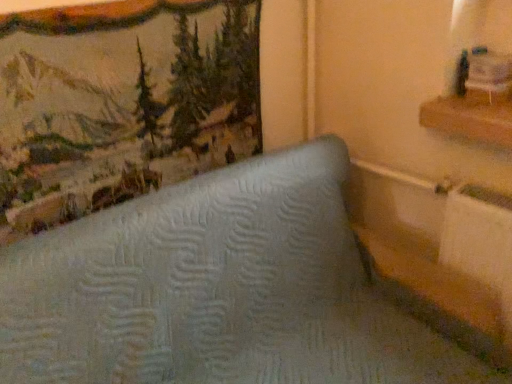
Question: Is light blue quilted mattress at center outside of wooden shelf at upper right?

Choices:
 (A) yes
 (B) no

Answer: (A)

Question: Is light blue quilted mattress at center thinner than wooden shelf at upper right?

Choices:
 (A) yes
 (B) no

Answer: (B)

Question: Is light blue quilted mattress at center further to camera compared to wooden shelf at upper right?

Choices:
 (A) no
 (B) yes

Answer: (A)

Question: Are light blue quilted mattress at center and wooden shelf at upper right beside each other?

Choices:
 (A) yes
 (B) no

Answer: (B)

Question: Can you confirm if light blue quilted mattress at center is wider than wooden shelf at upper right?

Choices:
 (A) yes
 (B) no

Answer: (A)

Question: Which is correct: light blue quilted mattress at center is inside wooden shelf at upper right, or outside of it?

Choices:
 (A) inside
 (B) outside

Answer: (B)

Question: Is point (510, 380) positioned closer to the camera than point (479, 100)?

Choices:
 (A) closer
 (B) farther

Answer: (A)

Question: From the image's perspective, is light blue quilted mattress at center positioned above or below wooden shelf at upper right?

Choices:
 (A) above
 (B) below

Answer: (B)

Question: Is light blue quilted mattress at center wider or thinner than wooden shelf at upper right?

Choices:
 (A) thin
 (B) wide

Answer: (B)

Question: From their relative heights in the image, would you say textured fabric picture frame at upper left is taller or shorter than light blue quilted mattress at center?

Choices:
 (A) tall
 (B) short

Answer: (B)

Question: From a real-world perspective, is textured fabric picture frame at upper left above or below light blue quilted mattress at center?

Choices:
 (A) below
 (B) above

Answer: (B)

Question: From the image's perspective, relative to light blue quilted mattress at center, is textured fabric picture frame at upper left above or below?

Choices:
 (A) below
 (B) above

Answer: (B)

Question: In terms of width, does textured fabric picture frame at upper left look wider or thinner when compared to light blue quilted mattress at center?

Choices:
 (A) wide
 (B) thin

Answer: (B)

Question: Choose the correct answer: Is wooden shelf at upper right inside light blue quilted mattress at center or outside it?

Choices:
 (A) outside
 (B) inside

Answer: (A)

Question: From their relative heights in the image, would you say wooden shelf at upper right is taller or shorter than light blue quilted mattress at center?

Choices:
 (A) short
 (B) tall

Answer: (A)